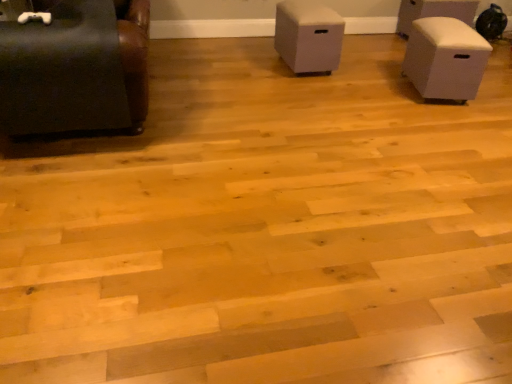
The image size is (512, 384). In order to click on white matte storage box at center, which is counted as the 2th furniture, starting from the left in this screenshot , I will do `click(308, 37)`.

How much space does white matte storage box at center, which is counted as the 2th furniture, starting from the left, occupy vertically?

It is 20.92 inches.

You are a GUI agent. You are given a task and a screenshot of the screen. Output one action in this format:
    pyautogui.click(x=<x>, y=<y>)
    Task: Click on the white fabric ottoman at upper right, which is counted as the 4th furniture, starting from the left
    
    Given the screenshot: What is the action you would take?
    pyautogui.click(x=434, y=12)

What do you see at coordinates (434, 12) in the screenshot? The image size is (512, 384). I see `white fabric ottoman at upper right, which is counted as the 4th furniture, starting from the left` at bounding box center [434, 12].

Identify the location of matte black couch at left, positioned as the 4th furniture in right-to-left order. coord(76,69).

Which is more to the right, white matte storage box at center, acting as the third furniture starting from the right, or matte black couch at left, marked as the first furniture in a left-to-right arrangement?

white matte storage box at center, acting as the third furniture starting from the right.

Is white matte storage box at center, acting as the third furniture starting from the right, positioned far away from matte black couch at left, the fourth furniture positioned from the back?

That's right, there is a large distance between white matte storage box at center, acting as the third furniture starting from the right, and matte black couch at left, the fourth furniture positioned from the back.

At what (x,y) coordinates should I click in order to perform the action: click on furniture that is the 1st object directly below the matte black couch at left, the 1th furniture positioned from the front (from a real-world perspective). Please return your answer as a coordinate pair (x, y). Image resolution: width=512 pixels, height=384 pixels. Looking at the image, I should click on (308, 37).

Between white matte storage box at center, placed as the second furniture when sorted from back to front, and matte black couch at left, positioned as the 4th furniture in right-to-left order, which one has larger width?

With larger width is matte black couch at left, positioned as the 4th furniture in right-to-left order.

Is matte black couch at left, positioned as the 4th furniture in right-to-left order, placed right next to white matte storage box at center, which is counted as the 2th furniture, starting from the left?

matte black couch at left, positioned as the 4th furniture in right-to-left order, and white matte storage box at center, which is counted as the 2th furniture, starting from the left, are clearly separated.

Does matte black couch at left, positioned as the 4th furniture in right-to-left order, turn towards white matte storage box at center, acting as the third furniture starting from the right?

No, matte black couch at left, positioned as the 4th furniture in right-to-left order, is not oriented towards white matte storage box at center, acting as the third furniture starting from the right.

Considering the positions of objects matte black couch at left, the fourth furniture positioned from the back, and white matte storage box at center, which is counted as the 2th furniture, starting from the left, in the image provided, who is in front, matte black couch at left, the fourth furniture positioned from the back, or white matte storage box at center, which is counted as the 2th furniture, starting from the left,?

matte black couch at left, the fourth furniture positioned from the back, is more forward.

Can you see matte black couch at left, the 1th furniture positioned from the front, touching beige matte storage box at right, which is counted as the third furniture, starting from the left?

There is a gap between matte black couch at left, the 1th furniture positioned from the front, and beige matte storage box at right, which is counted as the third furniture, starting from the left.

From a real-world perspective, is matte black couch at left, marked as the first furniture in a left-to-right arrangement, located higher than beige matte storage box at right, which is counted as the third furniture, starting from the left?

Correct, in the physical world, matte black couch at left, marked as the first furniture in a left-to-right arrangement, is higher than beige matte storage box at right, which is counted as the third furniture, starting from the left.

Is matte black couch at left, marked as the first furniture in a left-to-right arrangement, in front of or behind beige matte storage box at right, placed as the second furniture when sorted from front to back, in the image?

In the image, matte black couch at left, marked as the first furniture in a left-to-right arrangement, appears in front of beige matte storage box at right, placed as the second furniture when sorted from front to back.

How different are the orientations of matte black couch at left, positioned as the 4th furniture in right-to-left order, and beige matte storage box at right, which is counted as the third furniture, starting from the left, in degrees?

They differ by 12.1 degrees in their facing directions.

From a real-world perspective, is white fabric ottoman at upper right, positioned as the 1th furniture in right-to-left order, positioned under white matte storage box at center, acting as the third furniture starting from the right, based on gravity?

Correct, in the physical world, white fabric ottoman at upper right, positioned as the 1th furniture in right-to-left order, is lower than white matte storage box at center, acting as the third furniture starting from the right.

Is white fabric ottoman at upper right, positioned as the 1th furniture in right-to-left order, in contact with white matte storage box at center, which is the third furniture from front to back?

No, white fabric ottoman at upper right, positioned as the 1th furniture in right-to-left order, is not in contact with white matte storage box at center, which is the third furniture from front to back.

Between white fabric ottoman at upper right, marked as the 4th furniture in a front-to-back arrangement, and white matte storage box at center, which is the third furniture from front to back, which one appears on the right side from the viewer's perspective?

Positioned to the right is white fabric ottoman at upper right, marked as the 4th furniture in a front-to-back arrangement.

From the image's perspective, is beige matte storage box at right, which is counted as the second furniture, starting from the right, located above white matte storage box at center, acting as the third furniture starting from the right?

No, from the image's perspective, beige matte storage box at right, which is counted as the second furniture, starting from the right, is not on top of white matte storage box at center, acting as the third furniture starting from the right.

From the picture: Considering the sizes of objects beige matte storage box at right, the third furniture viewed from the back, and white matte storage box at center, acting as the third furniture starting from the right, in the image provided, who is wider, beige matte storage box at right, the third furniture viewed from the back, or white matte storage box at center, acting as the third furniture starting from the right,?

Wider between the two is white matte storage box at center, acting as the third furniture starting from the right.

Would you consider beige matte storage box at right, which is counted as the second furniture, starting from the right, to be distant from white matte storage box at center, which is the third furniture from front to back?

No, there isn't a large distance between beige matte storage box at right, which is counted as the second furniture, starting from the right, and white matte storage box at center, which is the third furniture from front to back.

Could you tell me if beige matte storage box at right, which is counted as the third furniture, starting from the left, is turned towards white matte storage box at center, acting as the third furniture starting from the right?

Yes, beige matte storage box at right, which is counted as the third furniture, starting from the left, is turned towards white matte storage box at center, acting as the third furniture starting from the right.

Is beige matte storage box at right, which is counted as the second furniture, starting from the right, completely or partially inside white matte storage box at center, placed as the second furniture when sorted from back to front?

No, beige matte storage box at right, which is counted as the second furniture, starting from the right, is not a part of white matte storage box at center, placed as the second furniture when sorted from back to front.

How much distance is there between white matte storage box at center, acting as the third furniture starting from the right, and beige matte storage box at right, the third furniture viewed from the back?

white matte storage box at center, acting as the third furniture starting from the right, and beige matte storage box at right, the third furniture viewed from the back, are 34.07 inches apart from each other.

Considering the relative positions of white matte storage box at center, placed as the second furniture when sorted from back to front, and beige matte storage box at right, the third furniture viewed from the back, in the image provided, is white matte storage box at center, placed as the second furniture when sorted from back to front, to the right of beige matte storage box at right, the third furniture viewed from the back, from the viewer's perspective?

In fact, white matte storage box at center, placed as the second furniture when sorted from back to front, is to the left of beige matte storage box at right, the third furniture viewed from the back.

Would you say white matte storage box at center, placed as the second furniture when sorted from back to front, is a long distance from beige matte storage box at right, which is counted as the third furniture, starting from the left?

No, there isn't a large distance between white matte storage box at center, placed as the second furniture when sorted from back to front, and beige matte storage box at right, which is counted as the third furniture, starting from the left.

Measure the distance between white fabric ottoman at upper right, arranged as the first furniture when viewed from the back, and matte black couch at left, the fourth furniture positioned from the back.

white fabric ottoman at upper right, arranged as the first furniture when viewed from the back, and matte black couch at left, the fourth furniture positioned from the back, are 3.55 meters apart from each other.

Considering the positions of objects white fabric ottoman at upper right, positioned as the 1th furniture in right-to-left order, and matte black couch at left, the fourth furniture positioned from the back, in the image provided, who is more to the left, white fabric ottoman at upper right, positioned as the 1th furniture in right-to-left order, or matte black couch at left, the fourth furniture positioned from the back,?

Positioned to the left is matte black couch at left, the fourth furniture positioned from the back.

Is point (404, 22) farther from viewer compared to point (17, 82)?

Yes, it is behind point (17, 82).

Find the location of a particular element. This screenshot has height=384, width=512. furniture that is on the left side of white matte storage box at center, placed as the second furniture when sorted from back to front is located at coordinates (76, 69).

Where is `furniture that is the 2nd one when counting downward from the white matte storage box at center, placed as the second furniture when sorted from back to front (from the image's perspective)`? furniture that is the 2nd one when counting downward from the white matte storage box at center, placed as the second furniture when sorted from back to front (from the image's perspective) is located at coordinates (76, 69).

From the picture: Considering their positions, is white matte storage box at center, placed as the second furniture when sorted from back to front, positioned closer to matte black couch at left, the fourth furniture positioned from the back, than white fabric ottoman at upper right, positioned as the 1th furniture in right-to-left order?

white matte storage box at center, placed as the second furniture when sorted from back to front, lies closer to matte black couch at left, the fourth furniture positioned from the back, than the other object.

From the image, which object appears to be nearer to white fabric ottoman at upper right, positioned as the 1th furniture in right-to-left order, matte black couch at left, the 1th furniture positioned from the front, or beige matte storage box at right, placed as the second furniture when sorted from front to back?

beige matte storage box at right, placed as the second furniture when sorted from front to back, lies closer to white fabric ottoman at upper right, positioned as the 1th furniture in right-to-left order, than the other object.

When comparing their distances from matte black couch at left, the 1th furniture positioned from the front, does white fabric ottoman at upper right, marked as the 4th furniture in a front-to-back arrangement, or white matte storage box at center, which is counted as the 2th furniture, starting from the left, seem closer?

Based on the image, white matte storage box at center, which is counted as the 2th furniture, starting from the left, appears to be nearer to matte black couch at left, the 1th furniture positioned from the front.

Considering their positions, is matte black couch at left, the 1th furniture positioned from the front, positioned closer to white matte storage box at center, acting as the third furniture starting from the right, than white fabric ottoman at upper right, arranged as the first furniture when viewed from the back?

Among the two, white fabric ottoman at upper right, arranged as the first furniture when viewed from the back, is located nearer to white matte storage box at center, acting as the third furniture starting from the right.

When comparing their distances from matte black couch at left, marked as the first furniture in a left-to-right arrangement, does white fabric ottoman at upper right, which is counted as the 4th furniture, starting from the left, or beige matte storage box at right, the third furniture viewed from the back, seem further?

white fabric ottoman at upper right, which is counted as the 4th furniture, starting from the left.

When comparing their distances from white matte storage box at center, which is counted as the 2th furniture, starting from the left, does white fabric ottoman at upper right, marked as the 4th furniture in a front-to-back arrangement, or beige matte storage box at right, which is counted as the third furniture, starting from the left, seem further?

white fabric ottoman at upper right, marked as the 4th furniture in a front-to-back arrangement, lies further to white matte storage box at center, which is counted as the 2th furniture, starting from the left, than the other object.

When comparing their distances from white fabric ottoman at upper right, positioned as the 1th furniture in right-to-left order, does white matte storage box at center, which is the third furniture from front to back, or beige matte storage box at right, which is counted as the third furniture, starting from the left, seem closer?

The object closer to white fabric ottoman at upper right, positioned as the 1th furniture in right-to-left order, is beige matte storage box at right, which is counted as the third furniture, starting from the left.

Which object lies further to the anchor point white matte storage box at center, which is counted as the 2th furniture, starting from the left, beige matte storage box at right, which is counted as the second furniture, starting from the right, or white fabric ottoman at upper right, positioned as the 1th furniture in right-to-left order?

The object further to white matte storage box at center, which is counted as the 2th furniture, starting from the left, is white fabric ottoman at upper right, positioned as the 1th furniture in right-to-left order.

Where is `furniture between matte black couch at left, the fourth furniture positioned from the back, and beige matte storage box at right, which is counted as the third furniture, starting from the left, in the horizontal direction`? This screenshot has width=512, height=384. furniture between matte black couch at left, the fourth furniture positioned from the back, and beige matte storage box at right, which is counted as the third furniture, starting from the left, in the horizontal direction is located at coordinates (308, 37).

At what (x,y) coordinates should I click in order to perform the action: click on furniture between white matte storage box at center, placed as the second furniture when sorted from back to front, and white fabric ottoman at upper right, marked as the 4th furniture in a front-to-back arrangement, in the horizontal direction. Please return your answer as a coordinate pair (x, y). The width and height of the screenshot is (512, 384). Looking at the image, I should click on (445, 59).